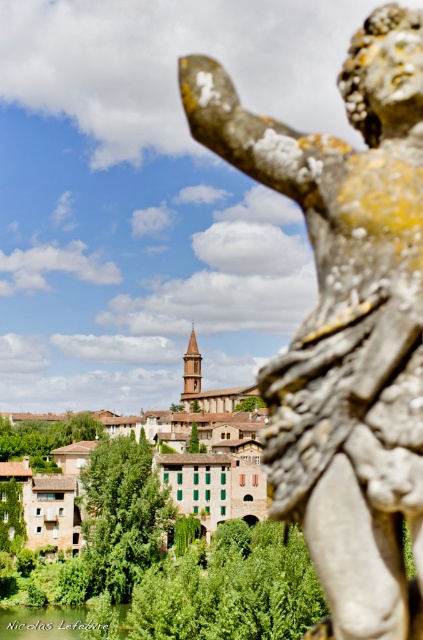
This screenshot has width=423, height=640. I want to click on bronze statue at upper right, so click(346, 321).

Is point (403, 177) positioned before point (183, 444)?

Yes.

The image size is (423, 640). What do you see at coordinates (346, 321) in the screenshot?
I see `bronze statue at upper right` at bounding box center [346, 321].

The width and height of the screenshot is (423, 640). I want to click on bronze statue at upper right, so click(346, 321).

Is bronze statue at upper right taller than green leafy river at lower left?

Correct, bronze statue at upper right is much taller as green leafy river at lower left.

Which of these two, bronze statue at upper right or green leafy river at lower left, stands shorter?

green leafy river at lower left

At what (x,y) coordinates should I click in order to perform the action: click on bronze statue at upper right. Please return your answer as a coordinate pair (x, y). The width and height of the screenshot is (423, 640). Looking at the image, I should click on (346, 321).

Who is shorter, brown stone buildings at center or green leafy river at lower left?

green leafy river at lower left

Does brown stone buildings at center have a greater height compared to green leafy river at lower left?

Indeed, brown stone buildings at center has a greater height compared to green leafy river at lower left.

Who is more forward, (211, 426) or (0, 616)?

Point (0, 616)

Find the location of a particular element. brown stone buildings at center is located at coordinates (159, 465).